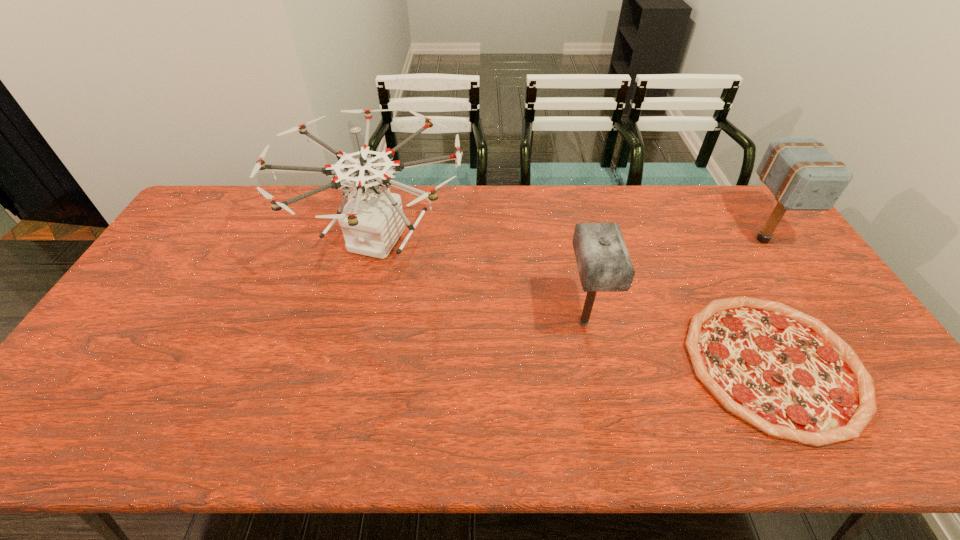
Find the location of a particular element. This screenshot has width=960, height=540. drone is located at coordinates (371, 221).

You are a GUI agent. You are given a task and a screenshot of the screen. Output one action in this format:
    pyautogui.click(x=<x>, y=<y>)
    Task: Click on the second object from left to right
    
    Given the screenshot: What is the action you would take?
    pyautogui.click(x=604, y=265)

Where is `the nearer mallet`? The width and height of the screenshot is (960, 540). the nearer mallet is located at coordinates (604, 265).

The width and height of the screenshot is (960, 540). What are the coordinates of `the right mallet` in the screenshot? It's located at tap(802, 174).

Locate an element on the screen. Image resolution: width=960 pixels, height=540 pixels. the shortest object is located at coordinates (786, 373).

You are a GUI agent. You are given a task and a screenshot of the screen. Output one action in this format:
    pyautogui.click(x=<x>, y=<y>)
    Task: Click on the free space located on the right of the leftmost object
    The height and width of the screenshot is (540, 960).
    Given the screenshot: What is the action you would take?
    pyautogui.click(x=520, y=239)

I want to click on vacant area located on the back of the nearer mallet, so click(564, 227).

The width and height of the screenshot is (960, 540). In order to click on free space located on the striking surface of the farther mallet in this screenshot , I will do `click(786, 275)`.

What are the coordinates of `vacant space located 0.100m on the left of the shortest object` in the screenshot? It's located at point(650,364).

What are the coordinates of `drone that is at the far edge` in the screenshot? It's located at (371, 221).